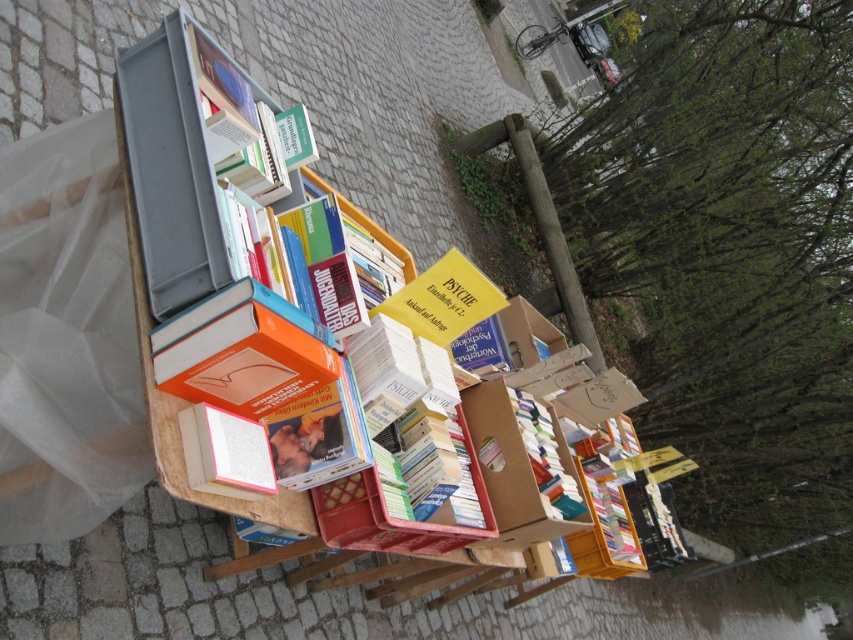
You are a customer at the outdoor book stall and want to reach both the point at (247, 285) and the point at (320, 561). Which point should you approach first to get closer to the viewer?

You should approach the point at (247, 285) first because it is closer to the viewer than the point at (320, 561).

In the scene shown: You are a customer at the outdoor book stall. You see the orange matte book at center and the wooden bookshelf at center. Which one is nearer to you?

The orange matte book at center is closer to the viewer than the wooden bookshelf at center.